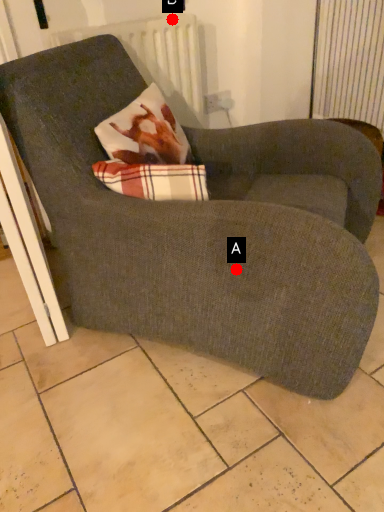
Question: Two points are circled on the image, labeled by A and B beside each circle. Which of the following is the farthest from the observer?

Choices:
 (A) A is further
 (B) B is further

Answer: (B)